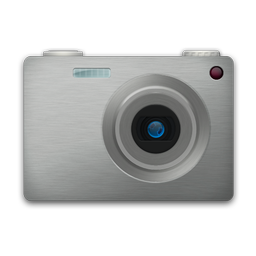
You are a GUI agent. You are given a task and a screenshot of the screen. Output one action in this format:
    pyautogui.click(x=<x>, y=<y>)
    Task: Click on the silver knobs
    The image size is (256, 256).
    Given the screenshot: What is the action you would take?
    pyautogui.click(x=206, y=52), pyautogui.click(x=61, y=51)